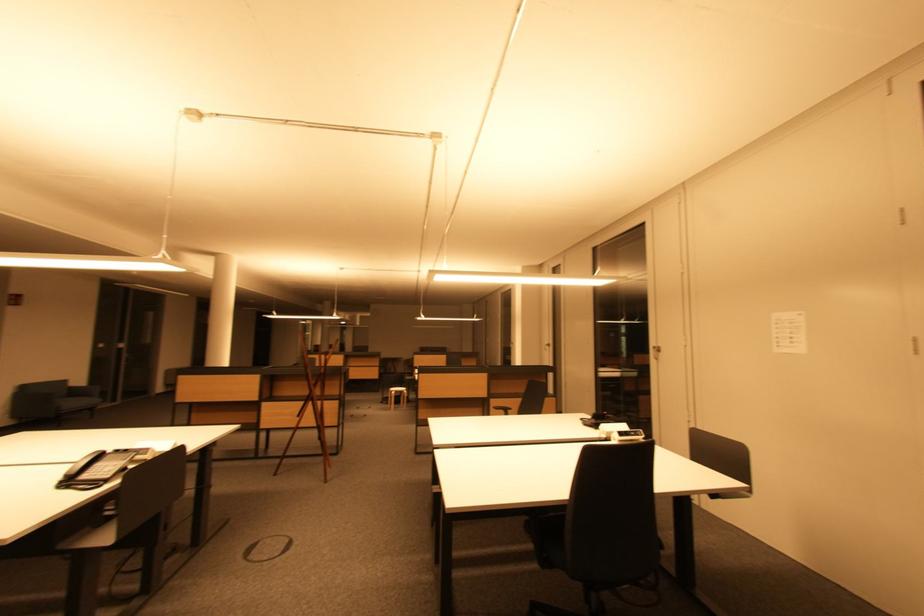
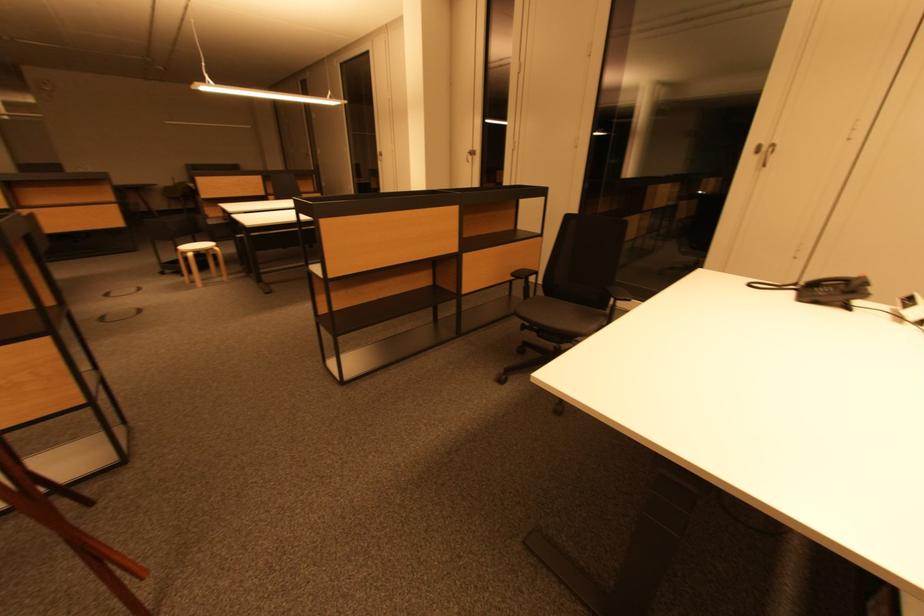
Locate, in the second image, the point that corresponds to (x=397, y=394) in the first image.

(193, 256)